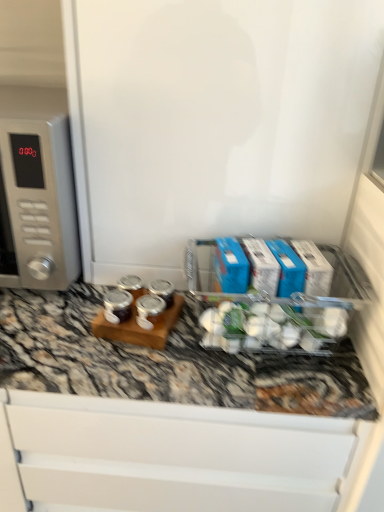
What is the approximate height of satin silver microwave at left?

The height of satin silver microwave at left is 12.29 inches.

Locate an element on the screen. The width and height of the screenshot is (384, 512). satin silver microwave at left is located at coordinates (40, 185).

What do you see at coordinates (40, 185) in the screenshot? I see `satin silver microwave at left` at bounding box center [40, 185].

Locate an element on the screen. This screenshot has width=384, height=512. clear plastic container at center is located at coordinates (276, 306).

Describe the element at coordinates (276, 306) in the screenshot. The height and width of the screenshot is (512, 384). I see `clear plastic container at center` at that location.

You are a GUI agent. You are given a task and a screenshot of the screen. Output one action in this format:
    pyautogui.click(x=<x>, y=<y>)
    Task: Click on the satin silver microwave at left
    The image size is (384, 512).
    Given the screenshot: What is the action you would take?
    tap(40, 185)

Is clear plastic container at center at the left side of satin silver microwave at left?

In fact, clear plastic container at center is to the right of satin silver microwave at left.

Is the position of clear plastic container at center more distant than that of satin silver microwave at left?

No, it is in front of satin silver microwave at left.

Is point (367, 295) closer to camera compared to point (28, 228)?

Yes, point (367, 295) is closer to viewer.

From the image's perspective, which is below, clear plastic container at center or satin silver microwave at left?

From the image's view, clear plastic container at center is below.

From a real-world perspective, which is physically above, clear plastic container at center or satin silver microwave at left?

In real-world perspective, satin silver microwave at left is above.

Can you confirm if clear plastic container at center is wider than satin silver microwave at left?

No, clear plastic container at center is not wider than satin silver microwave at left.

Which of these two, clear plastic container at center or satin silver microwave at left, stands taller?

satin silver microwave at left.

Considering the sizes of objects clear plastic container at center and satin silver microwave at left in the image provided, who is bigger, clear plastic container at center or satin silver microwave at left?

With larger size is satin silver microwave at left.

Choose the correct answer: Is clear plastic container at center inside satin silver microwave at left or outside it?

clear plastic container at center is not enclosed by satin silver microwave at left.

Does clear plastic container at center touch satin silver microwave at left?

No, clear plastic container at center is not beside satin silver microwave at left.

Is satin silver microwave at left at the back of clear plastic container at center?

No, clear plastic container at center is not facing the opposite direction of satin silver microwave at left.

How different are the orientations of clear plastic container at center and satin silver microwave at left in degrees?

0.892 degrees separate the facing orientations of clear plastic container at center and satin silver microwave at left.

The image size is (384, 512). Identify the location of home appliance located above the clear plastic container at center (from a real-world perspective). (40, 185).

Which object is positioned more to the right, satin silver microwave at left or clear plastic container at center?

clear plastic container at center.

Considering the relative positions of satin silver microwave at left and clear plastic container at center in the image provided, is satin silver microwave at left in front of clear plastic container at center?

No, satin silver microwave at left is further to the viewer.

Is point (35, 114) farther from viewer compared to point (338, 305)?

That is True.

From the image's perspective, between satin silver microwave at left and clear plastic container at center, who is located below?

From the image's view, clear plastic container at center is below.

From a real-world perspective, relative to clear plastic container at center, is satin silver microwave at left vertically above or below?

Clearly, from a real-world perspective, satin silver microwave at left is above clear plastic container at center.

In terms of width, does satin silver microwave at left look wider or thinner when compared to clear plastic container at center?

Considering their sizes, satin silver microwave at left looks broader than clear plastic container at center.

Which of these two, satin silver microwave at left or clear plastic container at center, stands shorter?

Standing shorter between the two is clear plastic container at center.

Does satin silver microwave at left have a smaller size compared to clear plastic container at center?

No.

Is satin silver microwave at left spatially inside clear plastic container at center, or outside of it?

satin silver microwave at left is not inside clear plastic container at center, it's outside.

Are satin silver microwave at left and clear plastic container at center located far from each other?

They are positioned close to each other.

Is satin silver microwave at left looking in the opposite direction of clear plastic container at center?

No, satin silver microwave at left is not facing the opposite direction of clear plastic container at center.

What's the angular difference between satin silver microwave at left and clear plastic container at center's facing directions?

There is a 0.892-degree angle between the facing directions of satin silver microwave at left and clear plastic container at center.

This screenshot has width=384, height=512. In order to click on appliance in front of the satin silver microwave at left in this screenshot , I will do `click(276, 306)`.

At what (x,y) coordinates should I click in order to perform the action: click on home appliance that appears behind the clear plastic container at center. Please return your answer as a coordinate pair (x, y). Looking at the image, I should click on (40, 185).

Locate an element on the screen. The height and width of the screenshot is (512, 384). home appliance that is above the clear plastic container at center (from a real-world perspective) is located at coordinates (40, 185).